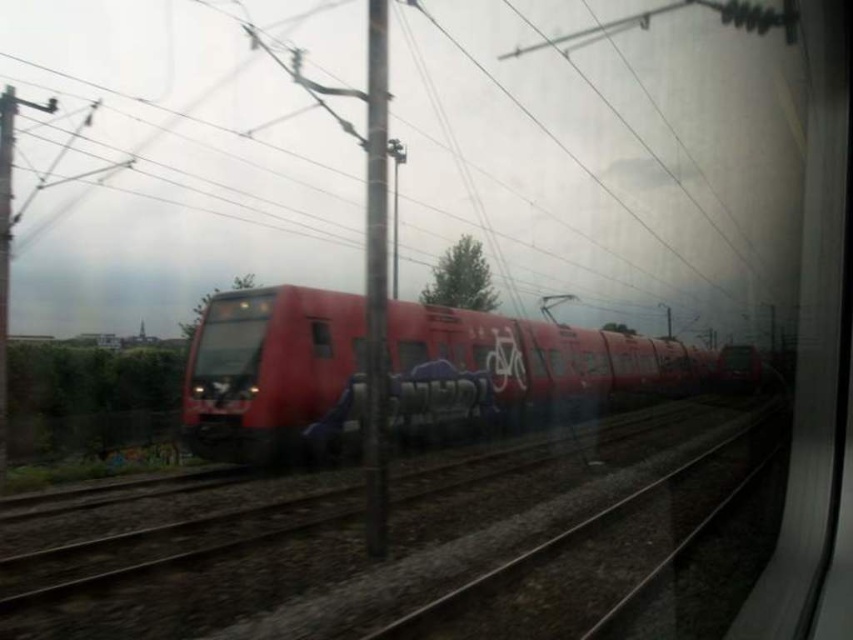
Question: Which object appears farthest from the camera in this image?

Choices:
 (A) metal track at center
 (B) matte red train at center
 (C) transparent glass window at center
 (D) transparent glass train at center

Answer: (D)

Question: Is metal track at center thinner than matte red train at center?

Choices:
 (A) yes
 (B) no

Answer: (A)

Question: Which point is closer to the camera?

Choices:
 (A) (219, 435)
 (B) (129, 529)

Answer: (B)

Question: Does transparent glass train at center have a larger size compared to transparent glass window at center?

Choices:
 (A) yes
 (B) no

Answer: (A)

Question: Is metallic pole at center bigger than transparent glass train at center?

Choices:
 (A) no
 (B) yes

Answer: (A)

Question: Which point is closer to the camera taking this photo?

Choices:
 (A) pos(328,336)
 (B) pos(582,384)
 (C) pos(413,349)
 (D) pos(370,230)

Answer: (D)